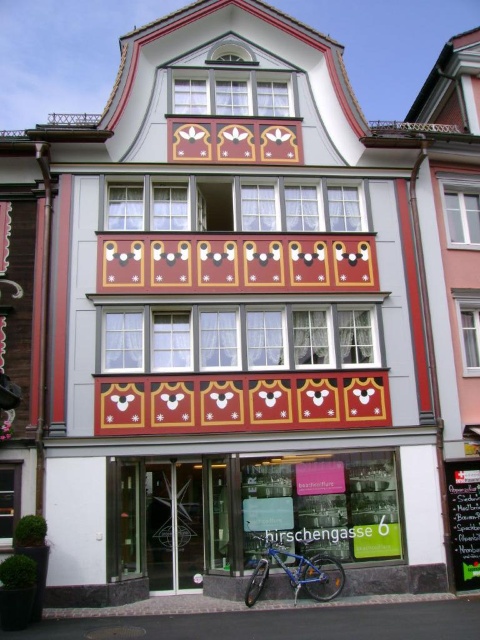
Question: Which point appears farthest from the camera in this image?

Choices:
 (A) (340, 566)
 (B) (233, 524)

Answer: (B)

Question: Which point is farther to the camera?

Choices:
 (A) (203, 544)
 (B) (336, 561)

Answer: (A)

Question: Considering the relative positions of metallic bicycle at lower center and blue metallic bicycle at lower center in the image provided, where is metallic bicycle at lower center located with respect to blue metallic bicycle at lower center?

Choices:
 (A) right
 (B) left

Answer: (B)

Question: Can you confirm if metallic bicycle at lower center is positioned below blue metallic bicycle at lower center?

Choices:
 (A) no
 (B) yes

Answer: (A)

Question: Is metallic bicycle at lower center to the right of blue metallic bicycle at lower center from the viewer's perspective?

Choices:
 (A) yes
 (B) no

Answer: (B)

Question: Among these objects, which one is nearest to the camera?

Choices:
 (A) blue metallic bicycle at lower center
 (B) metallic bicycle at lower center

Answer: (B)